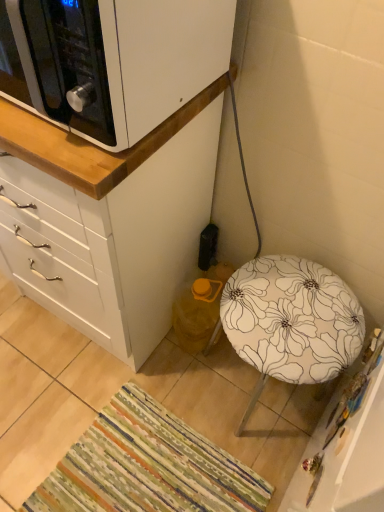
The height and width of the screenshot is (512, 384). What are the coordinates of `white floral fabric stool at lower right` in the screenshot? It's located at (290, 321).

Where is `multicolored woven mat at lower left`? This screenshot has width=384, height=512. multicolored woven mat at lower left is located at coordinates (147, 467).

You are a GUI agent. You are given a task and a screenshot of the screen. Output one action in this format:
    pyautogui.click(x=<x>, y=<y>)
    Task: Click on the black plastic electric outlet at lower center
    
    Given the screenshot: What is the action you would take?
    pyautogui.click(x=208, y=247)

This screenshot has width=384, height=512. What do you see at coordinates (114, 221) in the screenshot?
I see `white matte cabinet at upper left` at bounding box center [114, 221].

Locate an element on the screen. white floral fabric stool at lower right is located at coordinates (290, 321).

Is black plastic electric outlet at lower center positioned with its back to white matte cabinet at upper left?

That's not correct — black plastic electric outlet at lower center is not looking away from white matte cabinet at upper left.

Locate an element on the screen. This screenshot has width=384, height=512. cabinetry above the black plastic electric outlet at lower center (from a real-world perspective) is located at coordinates (119, 59).

Between point (200, 261) and point (61, 56), which one is positioned in front?

The point (61, 56) is more forward.

Which object is further away from the camera, black plastic electric outlet at lower center or white matte cabinet at upper left?

black plastic electric outlet at lower center.

What's the angular difference between white matte cabinet at upper left and multicolored woven mat at lower left's facing directions?

The facing directions of white matte cabinet at upper left and multicolored woven mat at lower left are 92.6 degrees apart.

From the image's perspective, is white matte cabinet at upper left on multicolored woven mat at lower left?

Yes.

Looking at this image, is white matte cabinet at upper left looking in the opposite direction of multicolored woven mat at lower left?

No, white matte cabinet at upper left is not facing away from multicolored woven mat at lower left.

Is there a large distance between white matte cabinet at upper left and multicolored woven mat at lower left?

That's not correct — white matte cabinet at upper left is a little close to multicolored woven mat at lower left.

Is white matte cabinet at upper left facing towards black plastic electric outlet at lower center?

No, white matte cabinet at upper left is not facing towards black plastic electric outlet at lower center.

Between white matte cabinet at upper left and black plastic electric outlet at lower center, which one is positioned behind?

black plastic electric outlet at lower center is more distant.

Is white matte cabinet at upper left next to black plastic electric outlet at lower center and touching it?

They are not placed beside each other.

From the image's perspective, between multicolored woven mat at lower left and white matte cabinet at upper left, who is located below?

multicolored woven mat at lower left is shown below in the image.

Is multicolored woven mat at lower left further to camera compared to white matte cabinet at upper left?

Yes.

Does black plastic electric outlet at lower center have a greater width compared to multicolored woven mat at lower left?

No, black plastic electric outlet at lower center is not wider than multicolored woven mat at lower left.

Is black plastic electric outlet at lower center at the left side of multicolored woven mat at lower left?

No.

From the picture: Which is farther, (204, 228) or (113, 428)?

Point (204, 228)

Looking at the image, does black plastic electric outlet at lower center seem bigger or smaller compared to multicolored woven mat at lower left?

black plastic electric outlet at lower center is smaller than multicolored woven mat at lower left.

How distant is white matte cabinet at upper left from white floral fabric stool at lower right?

The distance of white matte cabinet at upper left from white floral fabric stool at lower right is 58.56 centimeters.

Does white matte cabinet at upper left lie in front of white floral fabric stool at lower right?

Yes, white matte cabinet at upper left is closer to the camera.

Is white matte cabinet at upper left bigger or smaller than white floral fabric stool at lower right?

white matte cabinet at upper left is smaller than white floral fabric stool at lower right.

From the image's perspective, would you say white matte cabinet at upper left is positioned over white floral fabric stool at lower right?

Yes, from the image's perspective, white matte cabinet at upper left is over white floral fabric stool at lower right.

Are white matte cabinet at upper left and black plastic electric outlet at lower center making contact?

No, white matte cabinet at upper left is not touching black plastic electric outlet at lower center.

The width and height of the screenshot is (384, 512). I want to click on electric outlet located below the white matte cabinet at upper left (from the image's perspective), so click(x=208, y=247).

Between point (165, 239) and point (212, 243), which one is positioned behind?

Point (212, 243)

In the image, there is a white matte cabinet at upper left. Identify the location of electric outlet below it (from the image's perspective). (208, 247).

The width and height of the screenshot is (384, 512). Find the location of `mat that appears below the white matte cabinet at upper left (from a real-world perspective)`. mat that appears below the white matte cabinet at upper left (from a real-world perspective) is located at coordinates (147, 467).

Which object lies nearer to the anchor point multicolored woven mat at lower left, black plastic electric outlet at lower center or white matte cabinet at upper left?

white matte cabinet at upper left lies closer to multicolored woven mat at lower left than the other object.

When comparing their distances from white matte cabinet at upper left, does multicolored woven mat at lower left or white floral fabric stool at lower right seem closer?

white floral fabric stool at lower right.

When comparing their distances from black plastic electric outlet at lower center, does white floral fabric stool at lower right or white matte cabinet at upper left seem further?

white floral fabric stool at lower right lies further to black plastic electric outlet at lower center than the other object.

Considering their positions, is white matte cabinet at upper left positioned further to multicolored woven mat at lower left than black plastic electric outlet at lower center?

black plastic electric outlet at lower center is positioned further to the anchor multicolored woven mat at lower left.

Looking at the image, which one is located further to white matte cabinet at upper left, white matte cabinet at upper left or multicolored woven mat at lower left?

multicolored woven mat at lower left lies further to white matte cabinet at upper left than the other object.

Which object lies nearer to the anchor point white matte cabinet at upper left, white floral fabric stool at lower right or multicolored woven mat at lower left?

white floral fabric stool at lower right is closer to white matte cabinet at upper left.

Looking at the image, which one is located closer to white floral fabric stool at lower right, white matte cabinet at upper left or black plastic electric outlet at lower center?

black plastic electric outlet at lower center is closer to white floral fabric stool at lower right.

Based on their spatial positions, is white matte cabinet at upper left or white matte cabinet at upper left further from white floral fabric stool at lower right?

Among the two, white matte cabinet at upper left is located further to white floral fabric stool at lower right.

Where is `furniture between white matte cabinet at upper left and black plastic electric outlet at lower center in the front-back direction`? The image size is (384, 512). furniture between white matte cabinet at upper left and black plastic electric outlet at lower center in the front-back direction is located at coordinates (290, 321).

Identify the location of furniture between white matte cabinet at upper left and multicolored woven mat at lower left from top to bottom. The image size is (384, 512). (290, 321).

Identify the location of furniture located between white matte cabinet at upper left and black plastic electric outlet at lower center in the depth direction. The width and height of the screenshot is (384, 512). (290, 321).

Find the location of a particular element. electric outlet that lies between white matte cabinet at upper left and multicolored woven mat at lower left from top to bottom is located at coordinates (208, 247).